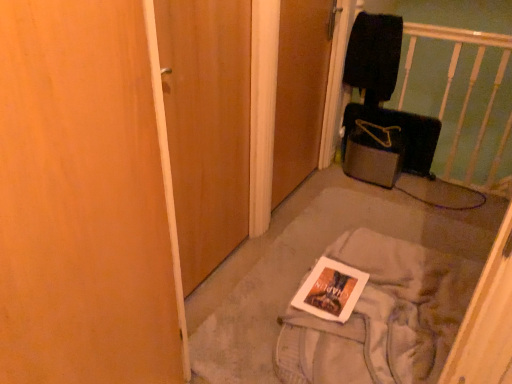
The width and height of the screenshot is (512, 384). I want to click on vacant area located to the right-hand side of wooden door at center, which is the 2th door in left-to-right order, so click(x=347, y=189).